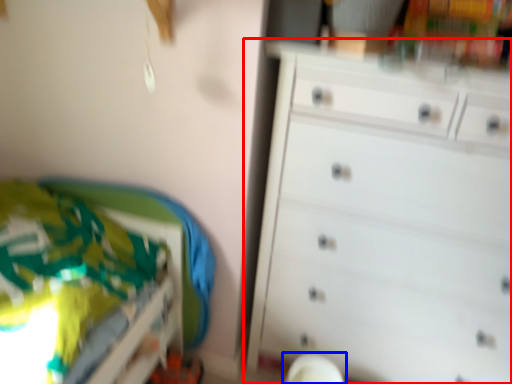
Question: Which point is closer to the camera, chest of drawers (highlighted by a red box) or swivel chair (highlighted by a blue box)?

Choices:
 (A) chest of drawers
 (B) swivel chair

Answer: (A)